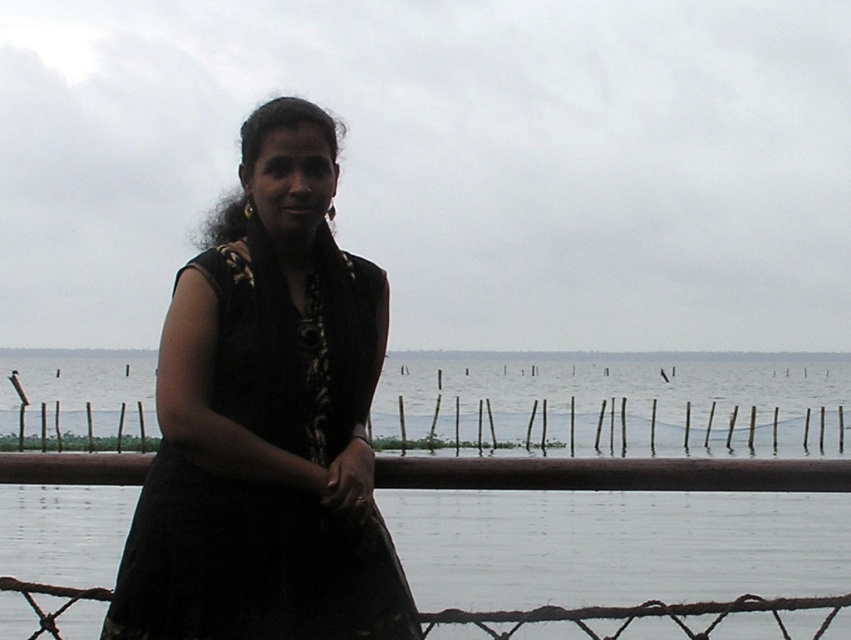
You are a fashion designer observing the scene. You notice the black fabric dress at center and the bamboo fence at center. Which object is shorter in height?

The black fabric dress at center is shorter than the bamboo fence at center.

You are a photographer trying to capture the entire scene of the transparent water at center and bamboo fence at center in one shot. Based on their sizes, which object will occupy more of the frame?

The transparent water at center is larger in size than the bamboo fence at center, so it will occupy more of the frame.